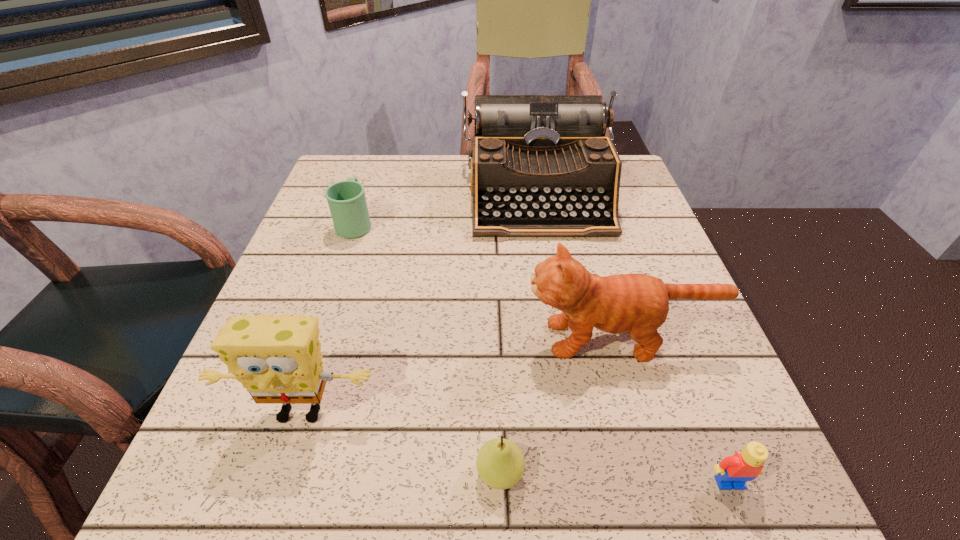
Identify which object is located as the fourth nearest to the mug. Please provide its 2D coordinates. Your answer should be formatted as a tuple, i.e. [(x, y)], where the tuple contains the x and y coordinates of a point satisfying the conditions above.

[(500, 463)]

The height and width of the screenshot is (540, 960). I want to click on free space that satisfies the following two spatial constraints: 1. on the face of the third farthest object; 2. on the front side of the pear, so click(x=657, y=473).

Where is `vacant region that satisfies the following two spatial constraints: 1. on the face of the fourth nearest object; 2. on the face of the third nearest object`? The width and height of the screenshot is (960, 540). vacant region that satisfies the following two spatial constraints: 1. on the face of the fourth nearest object; 2. on the face of the third nearest object is located at coordinates (639, 412).